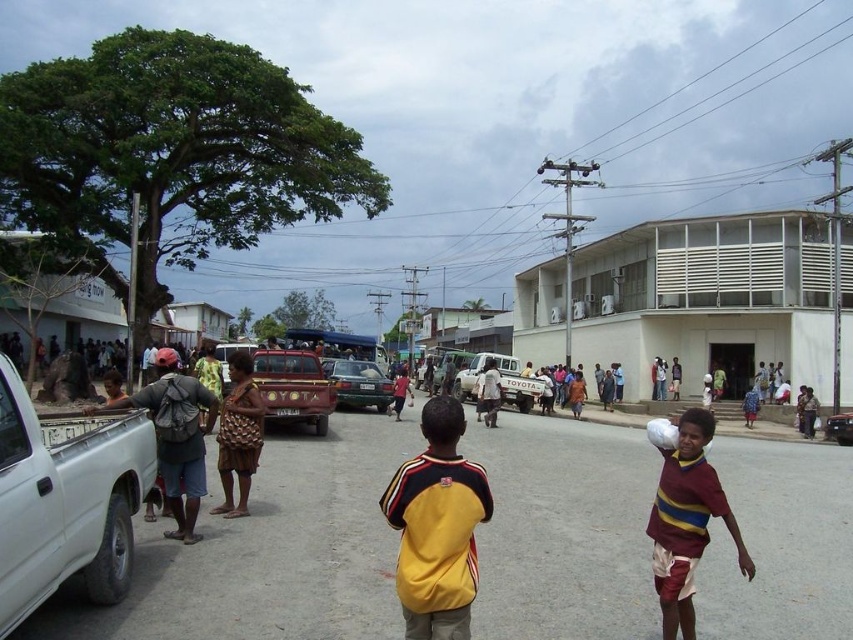
You are a delivery person who needs to load packages onto the white matte truck at center and the metallic red car at center. Which vehicle should you approach first if you want to load the one that is higher up first?

The white matte truck at center is located above the metallic red car at center, so you should approach the white matte truck at center first.

You are a delivery driver who needs to exit the street. You see the white matte truck at center and the metallic red car at center. Which vehicle is blocking your path?

The metallic red car at center is behind the white matte truck at center, so the white matte truck at center is blocking your path.

You are a delivery driver who needs to park your vehicle between the two white matte trucks in the scene. Can you fit your truck, which is 5 meters long, between the white matte pickup truck at left and the white matte truck at center?

The white matte pickup truck at left is positioned on the left side of white matte truck at center. However, the distance between them is not specified in the Objects Description, so it is impossible to determine if the 5 meter long truck can fit between them.